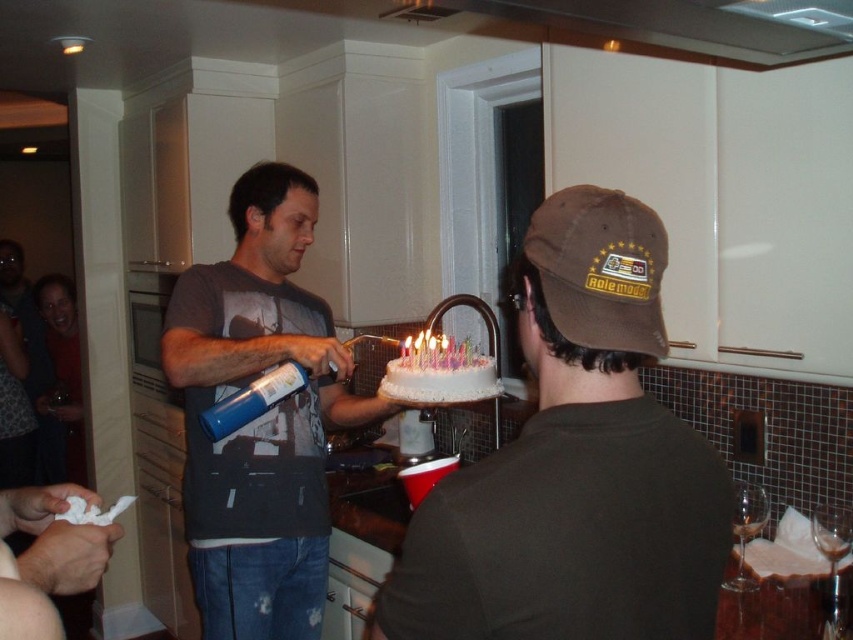
Who is more forward, (479, 544) or (383, 394)?

Point (479, 544)

Does point (619, 476) come behind point (456, 387)?

No, it is not.

Is point (717, 568) less distant than point (397, 369)?

Yes, point (717, 568) is in front of point (397, 369).

What are the coordinates of `brown cotton cap at center` in the screenshot? It's located at (575, 465).

Is brown cotton cap at center shorter than brown fabric baseball cap at upper right?

In fact, brown cotton cap at center may be taller than brown fabric baseball cap at upper right.

Who is shorter, brown cotton cap at center or brown fabric baseball cap at upper right?

Standing shorter between the two is brown fabric baseball cap at upper right.

What do you see at coordinates (575, 465) in the screenshot? This screenshot has width=853, height=640. I see `brown cotton cap at center` at bounding box center [575, 465].

Locate an element on the screen. brown cotton cap at center is located at coordinates (575, 465).

Does point (541, 269) come behind point (404, 396)?

No, it is in front of (404, 396).

Between point (598, 349) and point (488, 369), which one is positioned behind?

The point (488, 369) is more distant.

You are a GUI agent. You are given a task and a screenshot of the screen. Output one action in this format:
    pyautogui.click(x=<x>, y=<y>)
    Task: Click on the brown fabric baseball cap at upper right
    
    Given the screenshot: What is the action you would take?
    pyautogui.click(x=601, y=268)